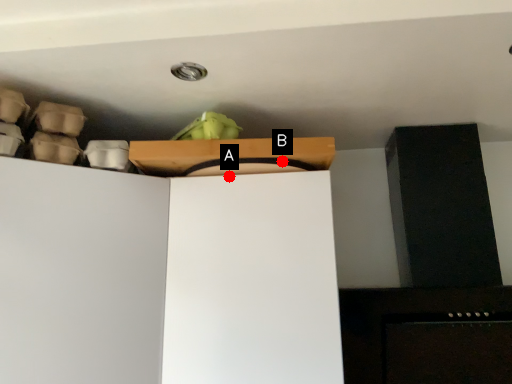
Question: Two points are circled on the image, labeled by A and B beside each circle. Which of the following is the farthest from the observer?

Choices:
 (A) A is further
 (B) B is further

Answer: (A)